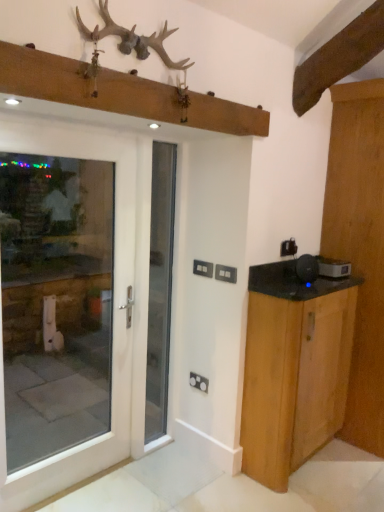
Question: Does black plastic speaker at right, which is the 1th appliance in left-to-right order, have a smaller size compared to antlered wooden rack at upper center?

Choices:
 (A) yes
 (B) no

Answer: (A)

Question: From the image's perspective, does black plastic speaker at right, the second appliance when ordered from back to front, appear higher than antlered wooden rack at upper center?

Choices:
 (A) no
 (B) yes

Answer: (A)

Question: Is black plastic speaker at right, the second appliance when ordered from back to front, taller than antlered wooden rack at upper center?

Choices:
 (A) no
 (B) yes

Answer: (A)

Question: Does black plastic speaker at right, the second appliance when ordered from back to front, have a greater width compared to antlered wooden rack at upper center?

Choices:
 (A) yes
 (B) no

Answer: (A)

Question: Is antlered wooden rack at upper center at the back of black plastic speaker at right, the 1th appliance positioned from the front?

Choices:
 (A) yes
 (B) no

Answer: (B)

Question: Relative to antlered wooden rack at upper center, is black plastic speaker at right, arranged as the second appliance when viewed from the left, in front or behind?

Choices:
 (A) behind
 (B) front

Answer: (A)

Question: Is black plastic speaker at right, arranged as the second appliance when viewed from the left, spatially inside antlered wooden rack at upper center, or outside of it?

Choices:
 (A) outside
 (B) inside

Answer: (A)

Question: Would you say black plastic speaker at right, which is the first appliance from right to left, is to the left or to the right of antlered wooden rack at upper center in the picture?

Choices:
 (A) left
 (B) right

Answer: (B)

Question: Is black plastic speaker at right, which is the first appliance from right to left, taller or shorter than antlered wooden rack at upper center?

Choices:
 (A) short
 (B) tall

Answer: (A)

Question: Is light wood cabinet at right in front of or behind wooden cabinet at right, which ranks as the second door in front-to-back order, in the image?

Choices:
 (A) front
 (B) behind

Answer: (A)

Question: From the image's perspective, is light wood cabinet at right positioned above or below wooden cabinet at right, acting as the 1th door starting from the back?

Choices:
 (A) below
 (B) above

Answer: (A)

Question: From a real-world perspective, is light wood cabinet at right positioned above or below wooden cabinet at right, the 1th door positioned from the right?

Choices:
 (A) below
 (B) above

Answer: (A)

Question: Do you think light wood cabinet at right is within wooden cabinet at right, acting as the 1th door starting from the back, or outside of it?

Choices:
 (A) outside
 (B) inside

Answer: (A)

Question: Is point (130, 342) positioned closer to the camera than point (152, 228)?

Choices:
 (A) closer
 (B) farther

Answer: (A)

Question: Is white glass door at left, which appears as the 1th door when viewed from the left, in front of or behind white glass door at center in the image?

Choices:
 (A) behind
 (B) front

Answer: (B)